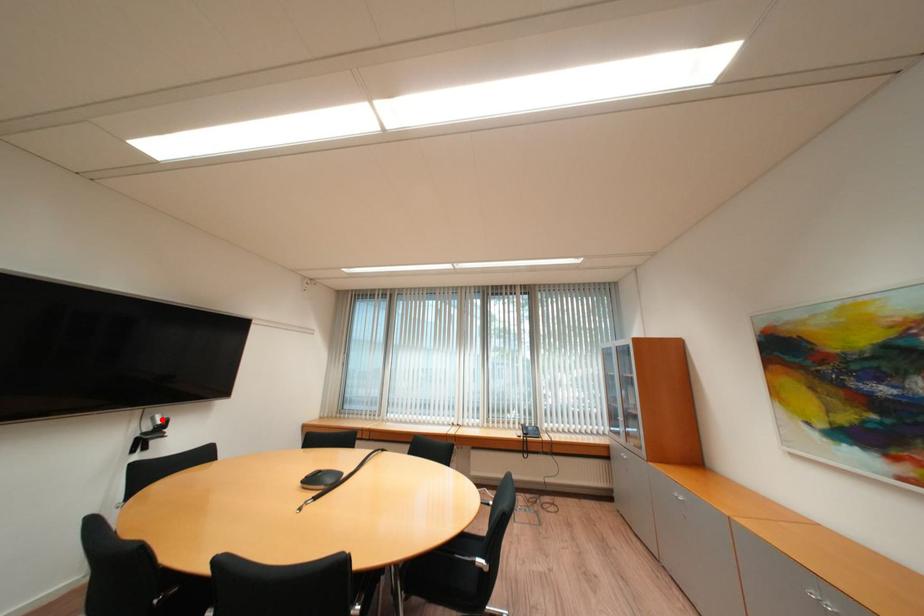
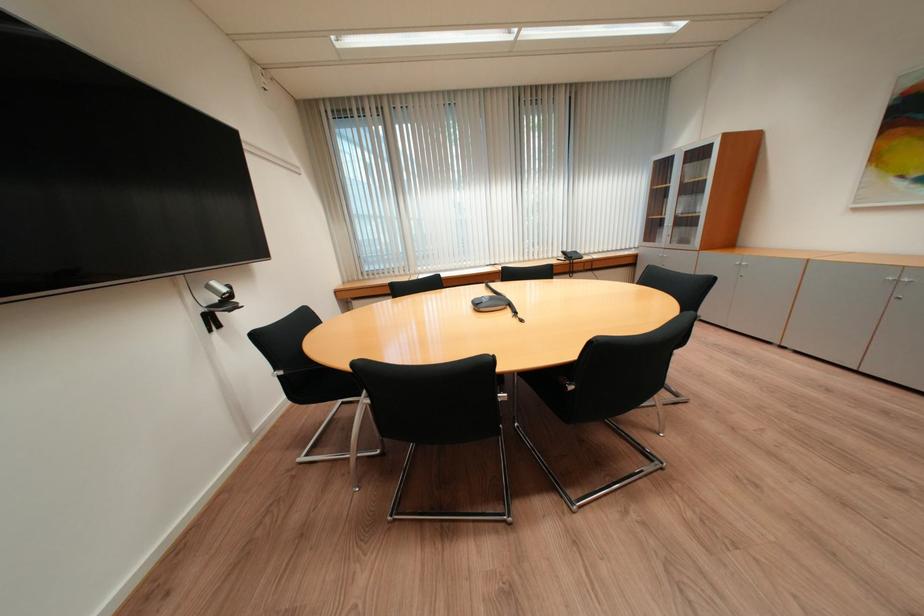
The point at the highlighted location is marked in the first image. Where is the corresponding point in the second image?

(217, 289)